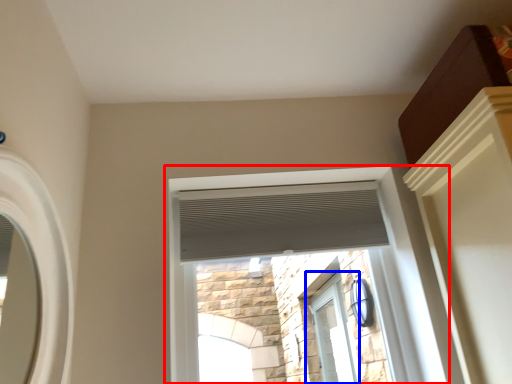
Question: Which object is closer to the camera taking this photo, window (highlighted by a red box) or window (highlighted by a blue box)?

Choices:
 (A) window
 (B) window

Answer: (A)